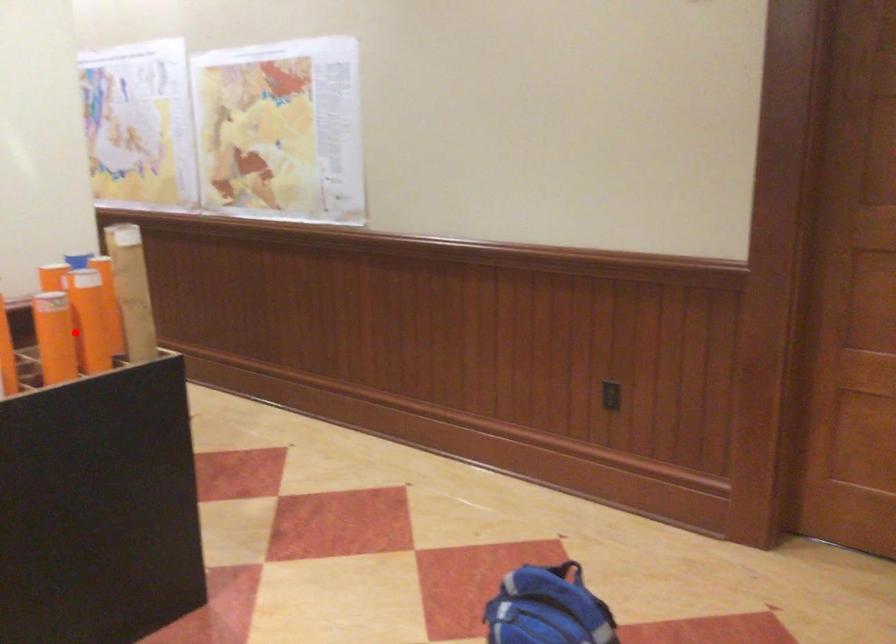
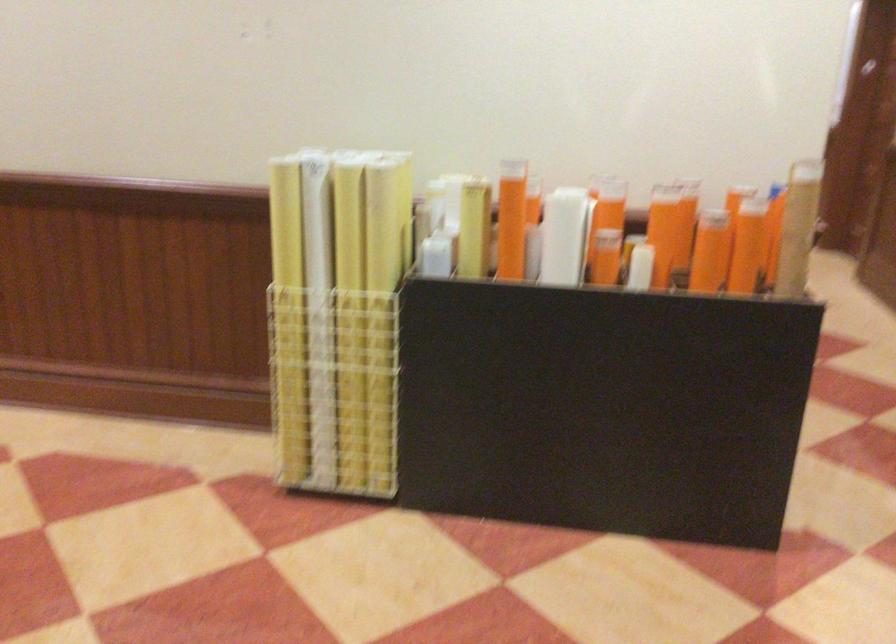
The point at the highlighted location is marked in the first image. Where is the corresponding point in the second image?

(710, 251)